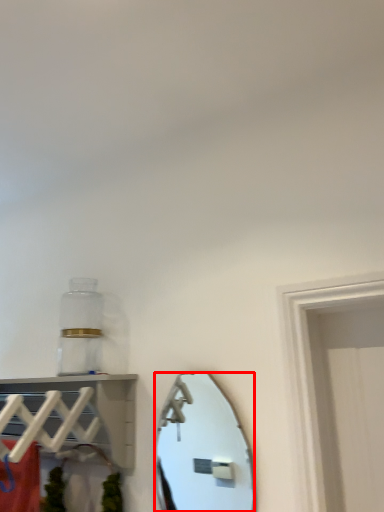
Question: Observing the image, what is the correct spatial positioning of mirror (annotated by the red box) in reference to shelf?

Choices:
 (A) right
 (B) left

Answer: (A)